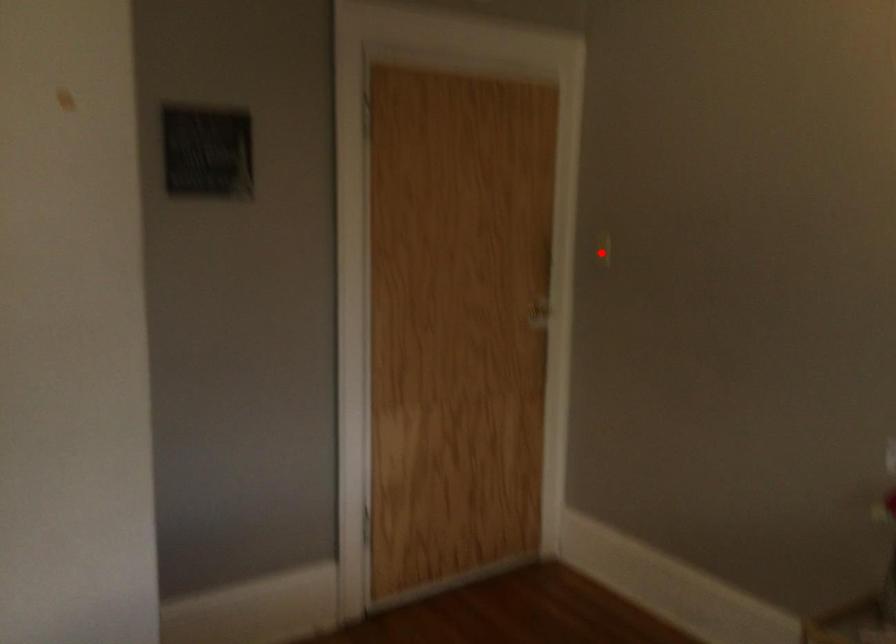
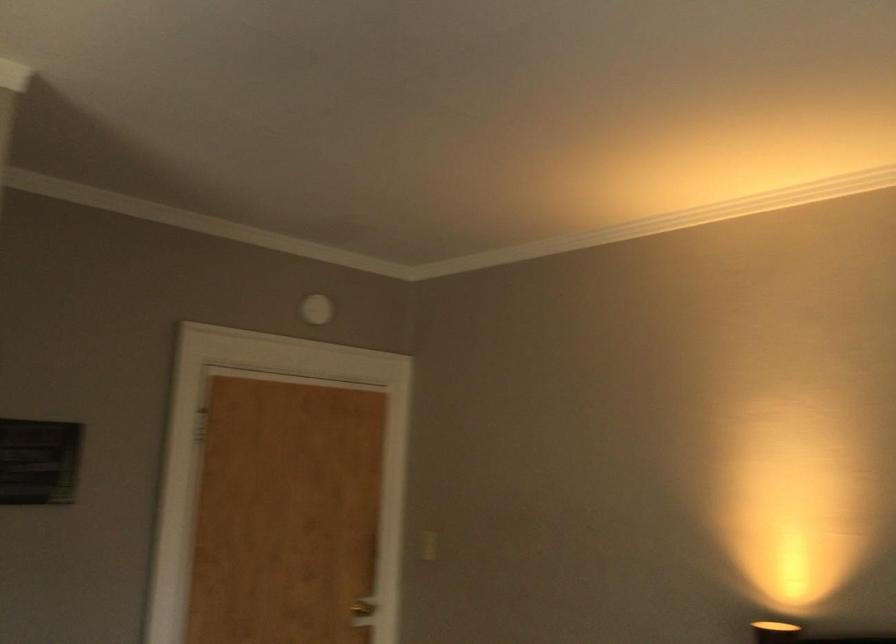
The point at the highlighted location is marked in the first image. Where is the corresponding point in the second image?

(427, 545)